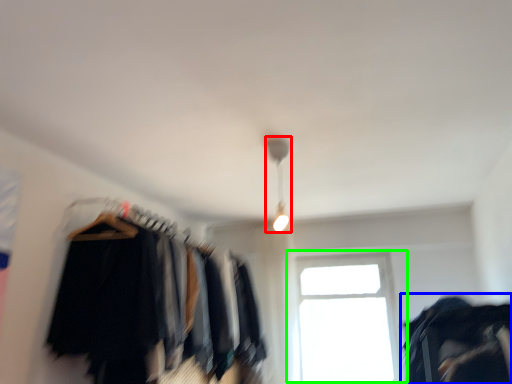
Question: Estimate the real-world distances between objects in this image. Which object is closer to lamp (highlighted by a red box), clothing (highlighted by a blue box) or window (highlighted by a green box)?

Choices:
 (A) clothing
 (B) window

Answer: (A)